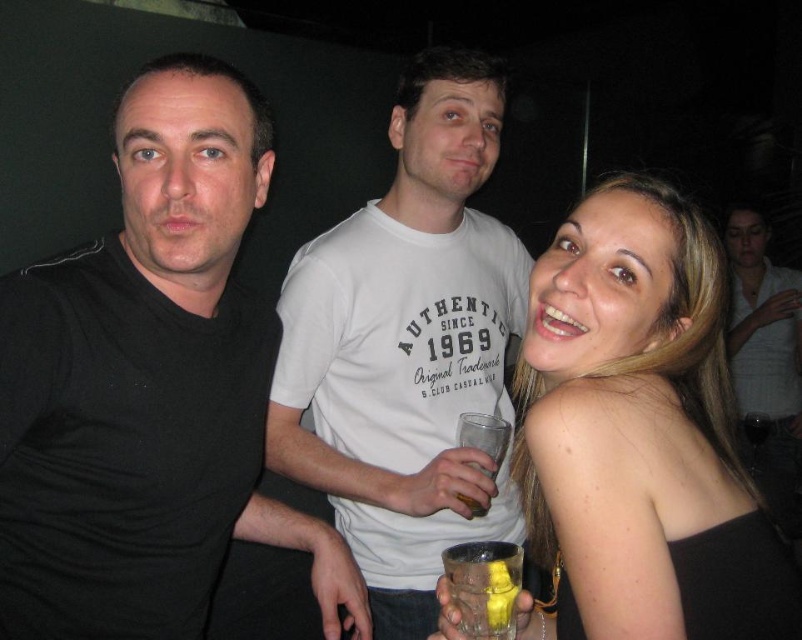
You are a bartender preparing drinks at the translucent glass at lower right. You need to hand a drink to the person wearing the black matte shirt at left. Can you reach them without moving from your current position?

The distance between the black matte shirt at left and the translucent glass at lower right is 15.44 inches. Since the average human arm length is about 25 inches, the bartender can easily reach the person wearing the black matte shirt at left without moving from their position.

In the scene shown: You are at a bar and see the black matte shirt at left and the translucent glass at lower right. Which object is closer to the camera?

The black matte shirt at left is closer to the camera because it is located above the translucent glass at lower right.